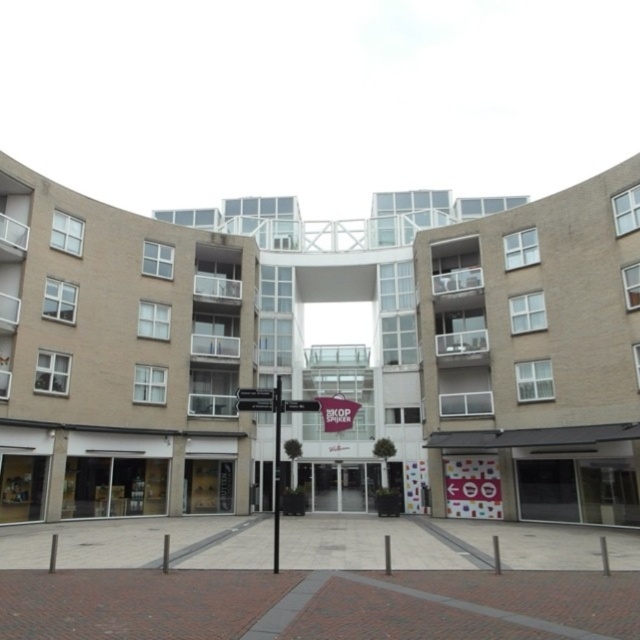
You are a visitor standing in front of the building and see the black metal signpost at center and the black metal pole at center. Which one is taller?

The black metal signpost at center is much taller than the black metal pole at center.

You are standing at the point marked by the coordinate point at point [534,356]. What structure are you directly facing?

The beige brick building at center is represented by point [534,356], so you are directly facing the beige brick building at center.

You are standing in front of the building and want to reach the glass bridge. You see the black metal signpost at center and the black metal pole at center. Which object is closer to you?

The black metal signpost at center is closer to you because it is in front of the black metal pole at center.